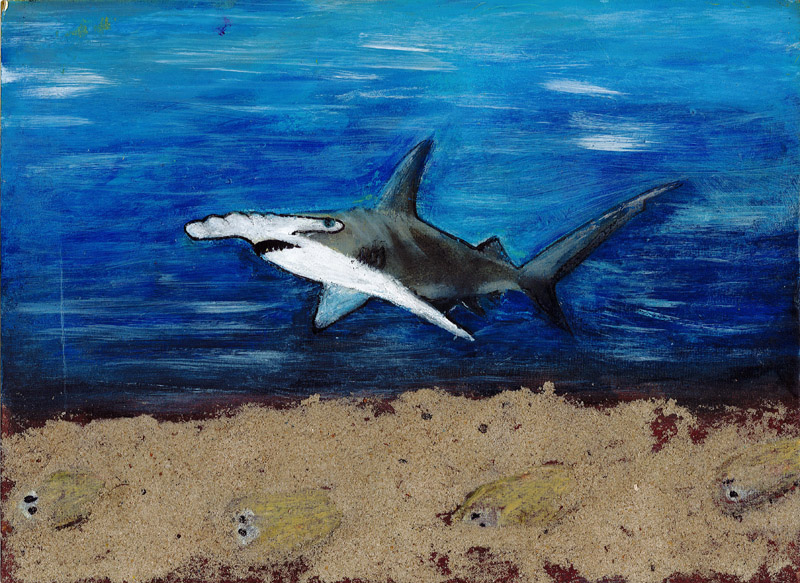
Find the location of a particular element. Image resolution: width=800 pixels, height=583 pixels. painting is located at coordinates (382, 338).